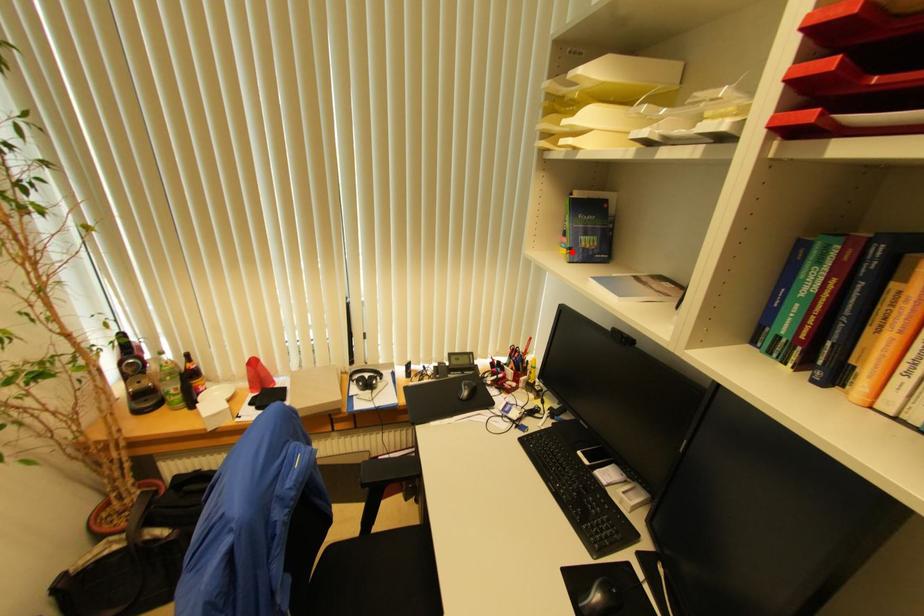
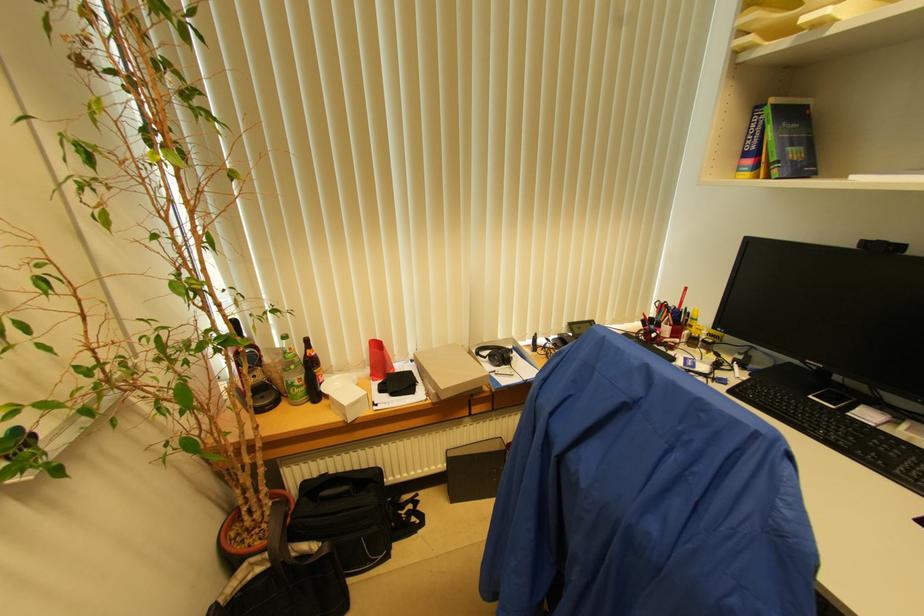
In the second image, find the point that corresponds to the highlighted location in the first image.

(780, 166)